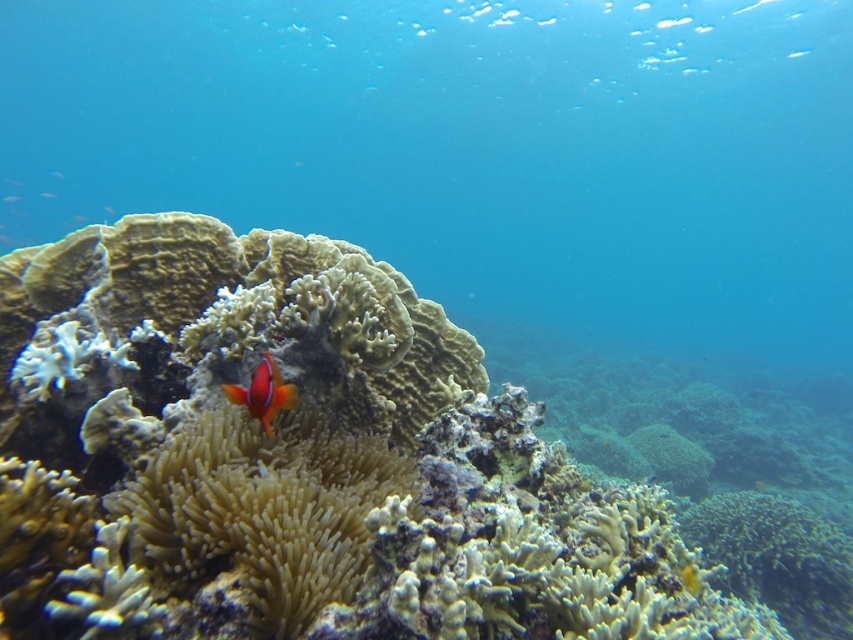
You are a marine biologist observing the underwater scene. You notice the translucent white anemone at center and the shiny orange clownfish at center. Which of these two has a taller height?

The translucent white anemone at center has a greater height compared to the shiny orange clownfish at center.

You are a marine biologist observing the underwater scene. You need to determine the relative widths of the transparent blue water at center and the shiny orange fish at center. Based on the scene, which one is wider?

The transparent blue water at center is wider than the shiny orange fish at center according to the description.